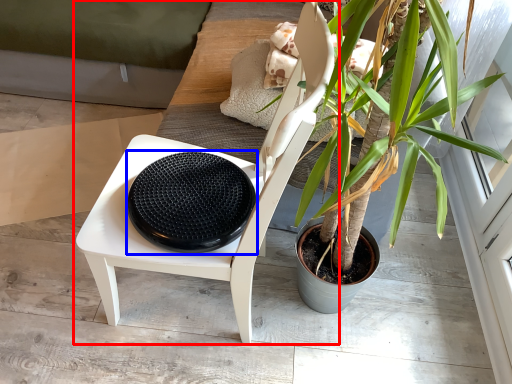
Question: Which of the following is the farthest to the observer, chair (highlighted by a red box) or footrest (highlighted by a blue box)?

Choices:
 (A) chair
 (B) footrest

Answer: (B)